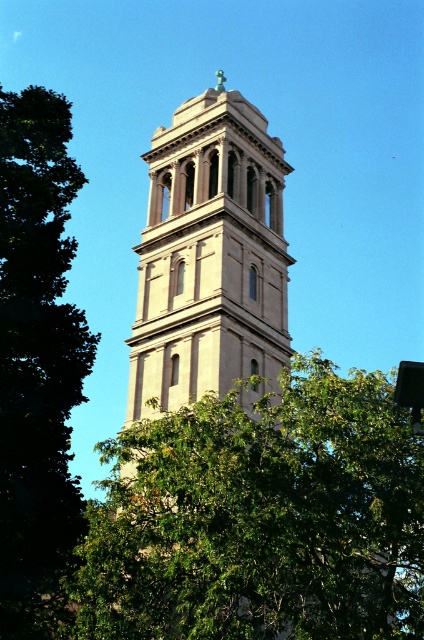
Which of these two, green leafy tree at center or green leafy tree at left, stands shorter?

green leafy tree at center

Can you confirm if green leafy tree at center is thinner than green leafy tree at left?

No, green leafy tree at center is not thinner than green leafy tree at left.

The image size is (424, 640). What do you see at coordinates (261, 518) in the screenshot?
I see `green leafy tree at center` at bounding box center [261, 518].

Where is `green leafy tree at center`? The width and height of the screenshot is (424, 640). green leafy tree at center is located at coordinates (261, 518).

Which is behind, point (153, 456) or point (270, 216)?

The point (270, 216) is more distant.

Who is positioned more to the right, green leafy tree at center or beige stone tower at center?

Positioned to the right is green leafy tree at center.

You are a GUI agent. You are given a task and a screenshot of the screen. Output one action in this format:
    pyautogui.click(x=<x>, y=<y>)
    Task: Click on the green leafy tree at center
    
    Given the screenshot: What is the action you would take?
    pyautogui.click(x=261, y=518)

Where is `green leafy tree at center`? Image resolution: width=424 pixels, height=640 pixels. green leafy tree at center is located at coordinates (261, 518).

At what (x,y) coordinates should I click in order to perform the action: click on beige stone tower at center. Please return your answer as a coordinate pair (x, y). This screenshot has width=424, height=640. Looking at the image, I should click on (209, 257).

Which of these two, beige stone tower at center or green leafy tree at left, stands shorter?

green leafy tree at left

Who is more distant from viewer, (276, 374) or (61, 182)?

The point (276, 374) is behind.

Where is `beige stone tower at center`? The height and width of the screenshot is (640, 424). beige stone tower at center is located at coordinates click(x=209, y=257).